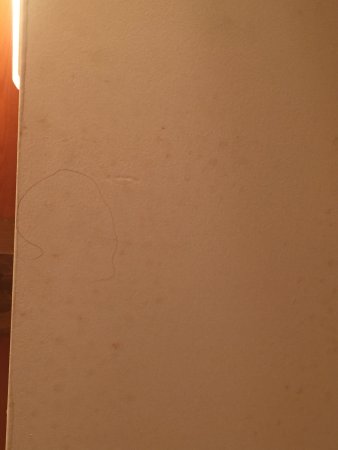
The image size is (338, 450). I want to click on book or notebook, so click(206, 132).